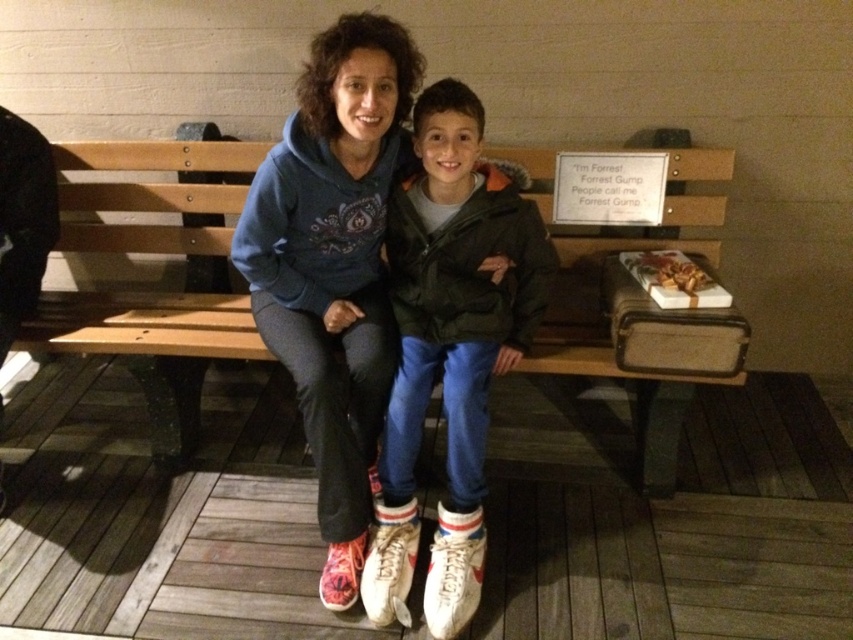
Does wooden bench at center have a greater height compared to white leather shoes at center?

Incorrect, wooden bench at center's height is not larger of white leather shoes at center's.

Does wooden bench at center have a larger size compared to white leather shoes at center?

Indeed, wooden bench at center has a larger size compared to white leather shoes at center.

Is point (670, 372) less distant than point (468, 268)?

Yes, it is.

Locate an element on the screen. This screenshot has width=853, height=640. wooden bench at center is located at coordinates coord(151,344).

Is matte blue hoodie at center positioned behind white leather shoes at center?

Yes, it is.

Who is shorter, matte blue hoodie at center or white leather shoes at center?

white leather shoes at center

You are a GUI agent. You are given a task and a screenshot of the screen. Output one action in this format:
    pyautogui.click(x=<x>, y=<y>)
    Task: Click on the matte blue hoodie at center
    
    Given the screenshot: What is the action you would take?
    pyautogui.click(x=334, y=266)

Which is behind, point (584, 364) or point (351, 342)?

The point (584, 364) is more distant.

Consider the image. Can you confirm if wooden bench at center is wider than matte blue hoodie at center?

Yes, wooden bench at center is wider than matte blue hoodie at center.

Locate an element on the screen. The width and height of the screenshot is (853, 640). wooden bench at center is located at coordinates (151, 344).

The height and width of the screenshot is (640, 853). I want to click on wooden bench at center, so click(x=151, y=344).